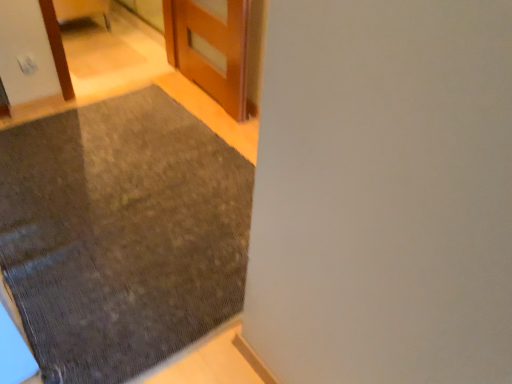
Question: In terms of height, does textured gray mat at lower left look taller or shorter compared to wooden door at upper center?

Choices:
 (A) tall
 (B) short

Answer: (B)

Question: Considering the positions of point (108, 253) and point (202, 3), is point (108, 253) closer or farther from the camera than point (202, 3)?

Choices:
 (A) closer
 (B) farther

Answer: (A)

Question: Considering the positions of textured gray mat at lower left and wooden door at upper center in the image, is textured gray mat at lower left wider or thinner than wooden door at upper center?

Choices:
 (A) wide
 (B) thin

Answer: (A)

Question: Considering the positions of point (236, 44) and point (70, 231), is point (236, 44) closer or farther from the camera than point (70, 231)?

Choices:
 (A) farther
 (B) closer

Answer: (A)

Question: From the image's perspective, is wooden door at upper center above or below textured gray mat at lower left?

Choices:
 (A) above
 (B) below

Answer: (A)

Question: Is wooden door at upper center to the left or to the right of textured gray mat at lower left in the image?

Choices:
 (A) right
 (B) left

Answer: (A)

Question: Considering the positions of wooden door at upper center and textured gray mat at lower left in the image, is wooden door at upper center wider or thinner than textured gray mat at lower left?

Choices:
 (A) thin
 (B) wide

Answer: (A)